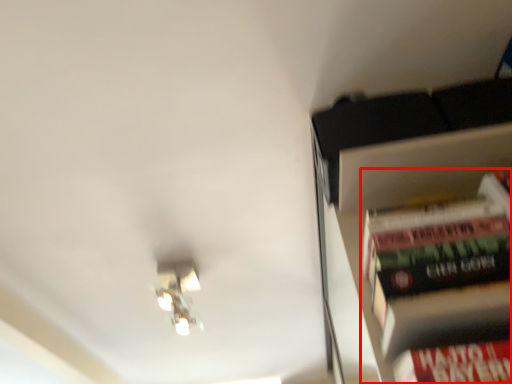
Question: Considering the relative positions of book (annotated by the red box) and light fixture in the image provided, where is book (annotated by the red box) located with respect to the staircase?

Choices:
 (A) right
 (B) left

Answer: (A)